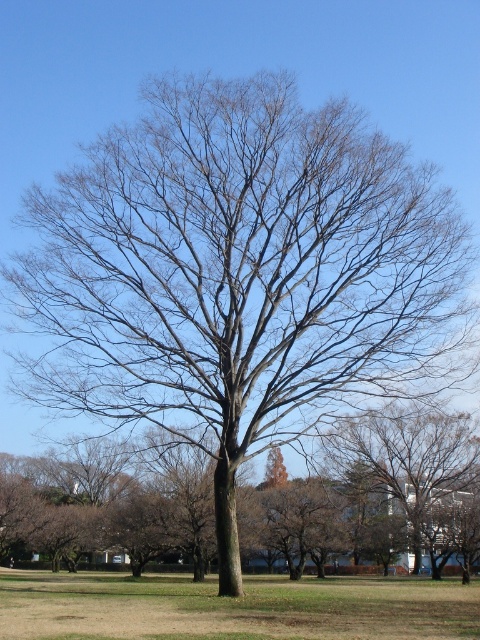
Who is more distant from viewer, (59, 600) or (384, 470)?

Positioned behind is point (384, 470).

Where is `green grass at center`? Image resolution: width=480 pixels, height=640 pixels. green grass at center is located at coordinates (232, 608).

Which is behind, point (36, 593) or point (377, 442)?

Point (377, 442)

Where is `green grass at center`? The width and height of the screenshot is (480, 640). green grass at center is located at coordinates (232, 608).